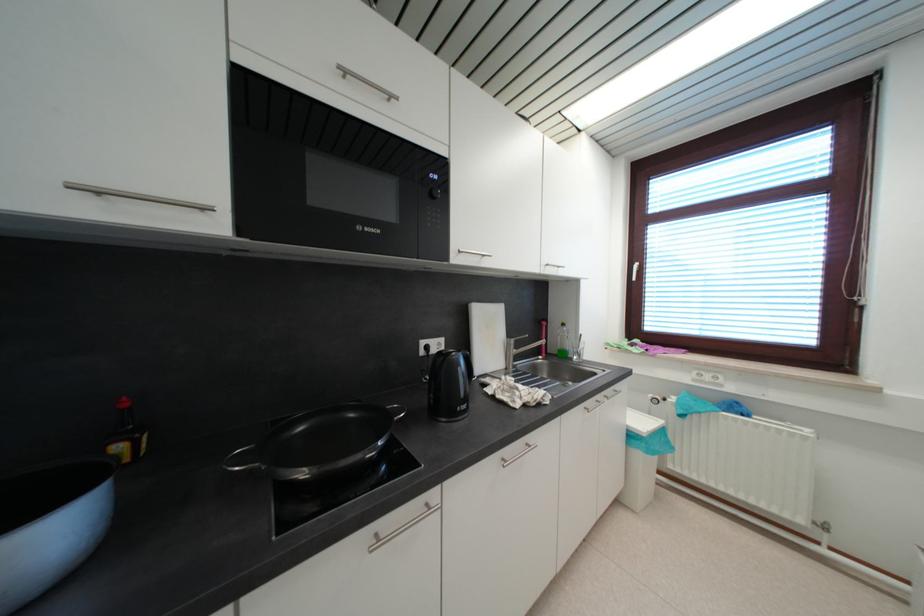
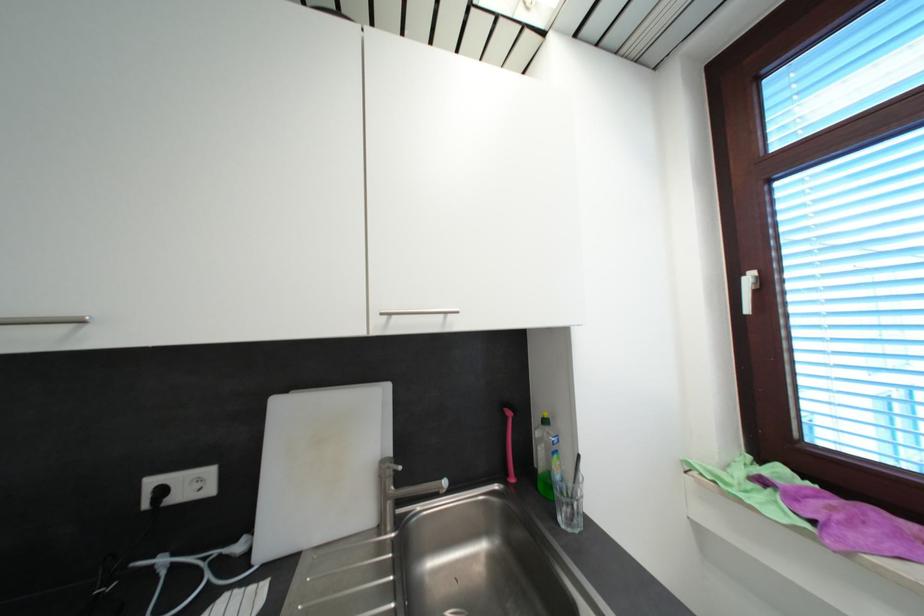
Consider the image. In a continuous first-person perspective shot, in which direction is the camera moving?

The cameraman walked toward right, forward.